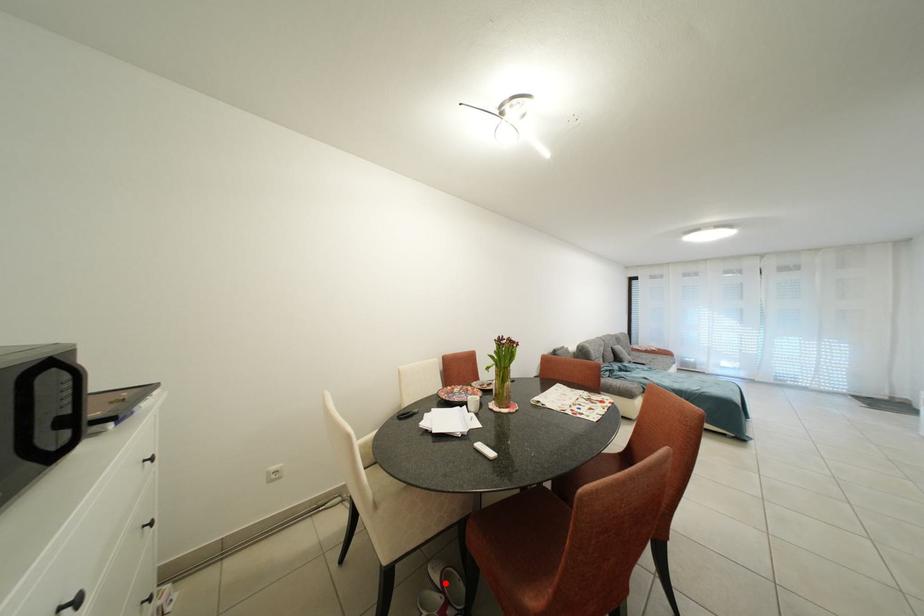
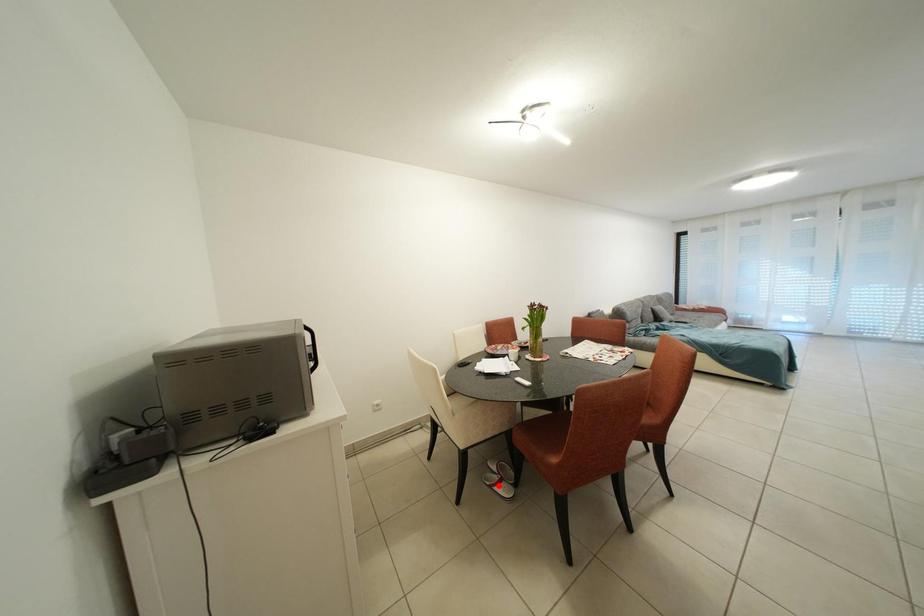
I am providing you with two images of the same scene from different viewpoints. A red point is marked on the first image and another point is marked on the second image. Are the points marked in image1 and image2 representing the same 3D position?

No